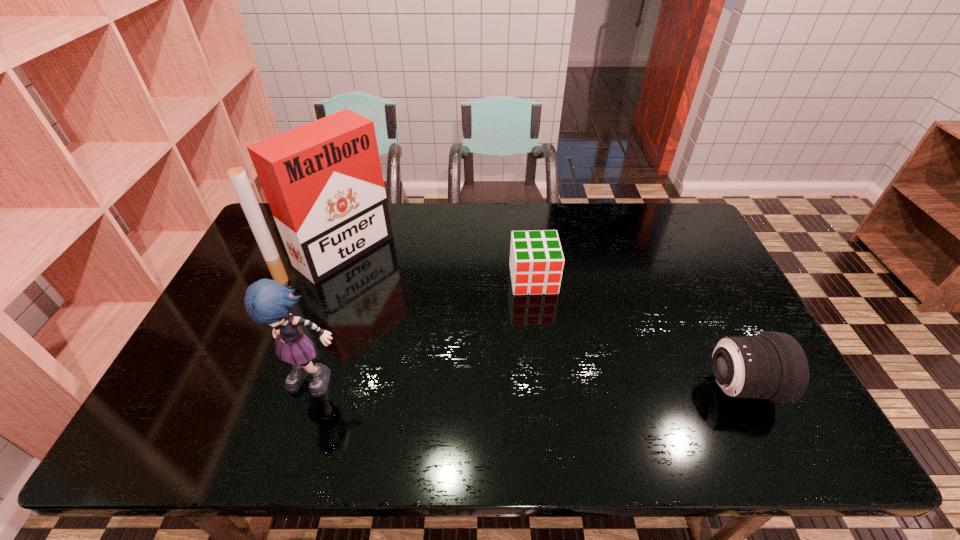
Where is `blank region between the telephoto lens and the cube`? This screenshot has width=960, height=540. blank region between the telephoto lens and the cube is located at coordinates (636, 333).

The width and height of the screenshot is (960, 540). What are the coordinates of `free area in between the tallest object and the second shortest object` in the screenshot? It's located at (540, 319).

Identify the location of blank region between the rightmost object and the second object from right to left. (636, 333).

You are a GUI agent. You are given a task and a screenshot of the screen. Output one action in this format:
    pyautogui.click(x=<x>, y=<y>)
    Task: Click on the free space between the telephoto lens and the third shortest object
    The width and height of the screenshot is (960, 540).
    Given the screenshot: What is the action you would take?
    [x=529, y=383]

Identify the location of free spot between the third shortest object and the telephoto lens. (529, 383).

Identify which object is the third closest to the second object from right to left. Please provide its 2D coordinates. Your answer should be formatted as a tuple, i.e. [(x, y)], where the tuple contains the x and y coordinates of a point satisfying the conditions above.

[(266, 301)]

At what (x,y) coordinates should I click in order to perform the action: click on object that stands as the closest to the third shortest object. Please return your answer as a coordinate pair (x, y). Image resolution: width=960 pixels, height=540 pixels. Looking at the image, I should click on (323, 181).

The height and width of the screenshot is (540, 960). Find the location of `vacant point that satisfies the following two spatial constraints: 1. on the front-facing side of the telephoto lens; 2. at the front element of the rag doll`. vacant point that satisfies the following two spatial constraints: 1. on the front-facing side of the telephoto lens; 2. at the front element of the rag doll is located at coordinates (317, 387).

This screenshot has width=960, height=540. I want to click on vacant space that satisfies the following two spatial constraints: 1. on the front-facing side of the third shortest object; 2. at the front element of the telephoto lens, so click(x=317, y=387).

Find the location of a particular element. This screenshot has height=540, width=960. vacant space that satisfies the following two spatial constraints: 1. on the front side of the second object from right to left; 2. at the front element of the telephoto lens is located at coordinates tap(546, 387).